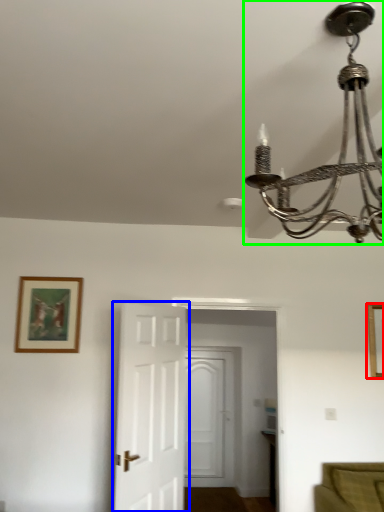
Question: Based on their relative distances, which object is farther from picture frame (highlighted by a red box)? Choose from door (highlighted by a blue box) and lamp (highlighted by a green box).

Choices:
 (A) door
 (B) lamp

Answer: (B)